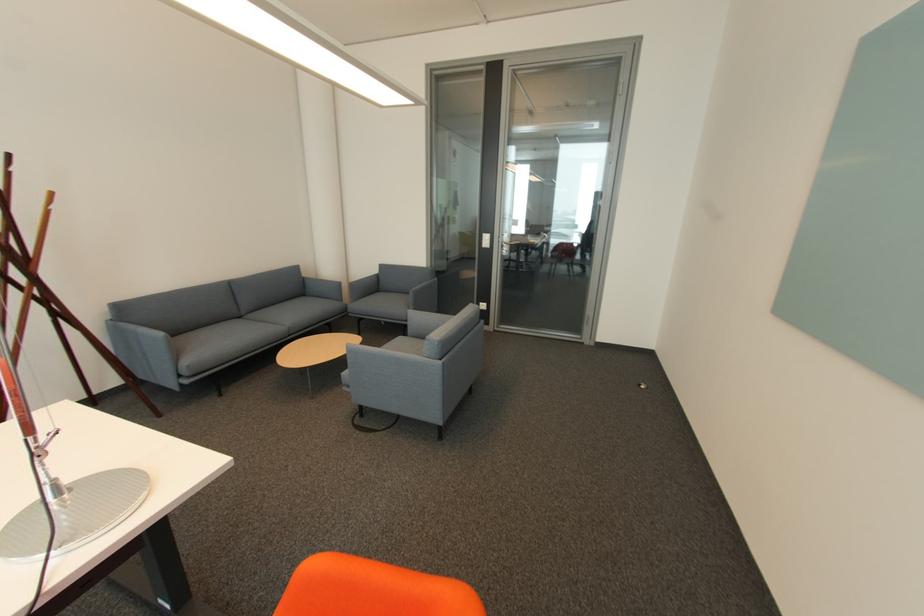
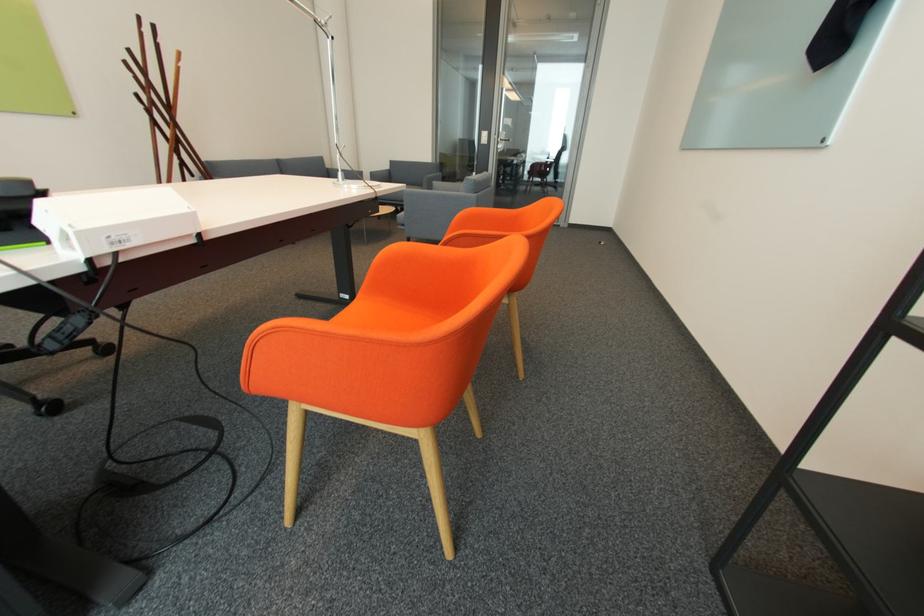
In the second image, find the point that corresponds to [355,387] in the first image.

(408, 225)